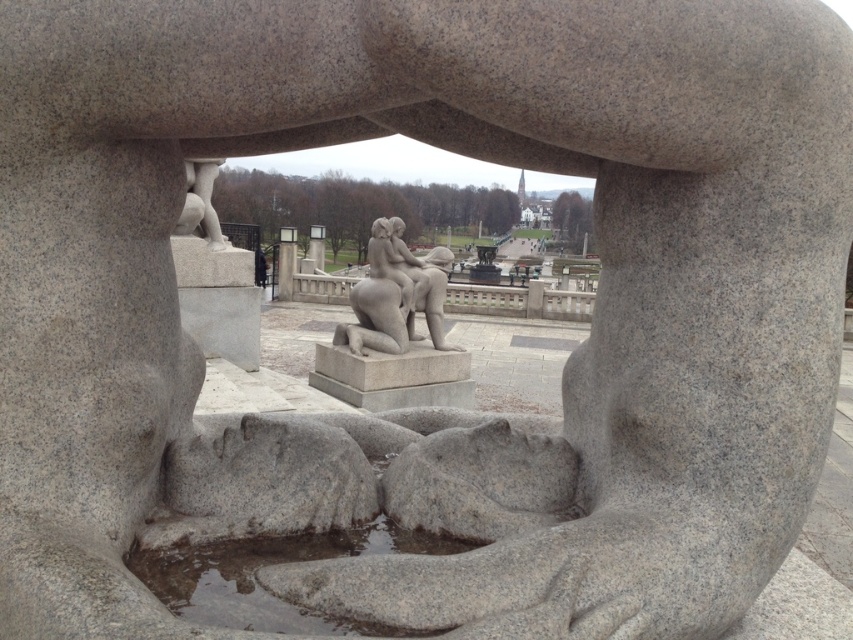
Does transparent stone puddle at lower center have a larger size compared to gray stone sculpture at center?

Incorrect, transparent stone puddle at lower center is not larger than gray stone sculpture at center.

Between point (235, 602) and point (393, 269), which one is positioned behind?

Point (393, 269)

Where is `transparent stone puddle at lower center`? transparent stone puddle at lower center is located at coordinates (270, 564).